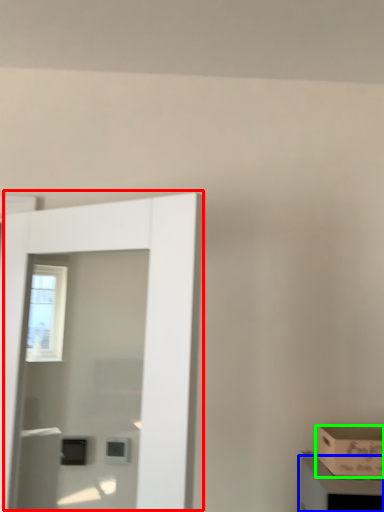
Question: Which object is the closest to the door (highlighted by a red box)? Choose among these: cabinetry (highlighted by a blue box) or box (highlighted by a green box).

Choices:
 (A) cabinetry
 (B) box

Answer: (A)